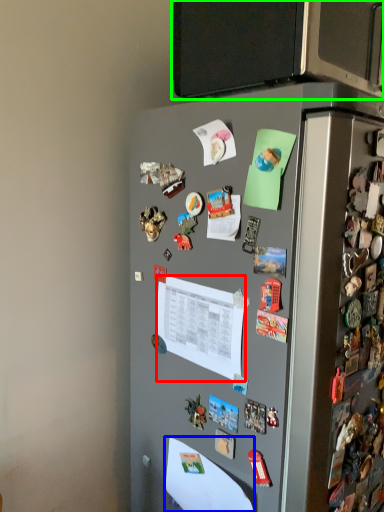
Question: Which is farther away from paper (highlighted by a red box)? paper (highlighted by a blue box) or back (highlighted by a green box)?

Choices:
 (A) paper
 (B) back

Answer: (B)